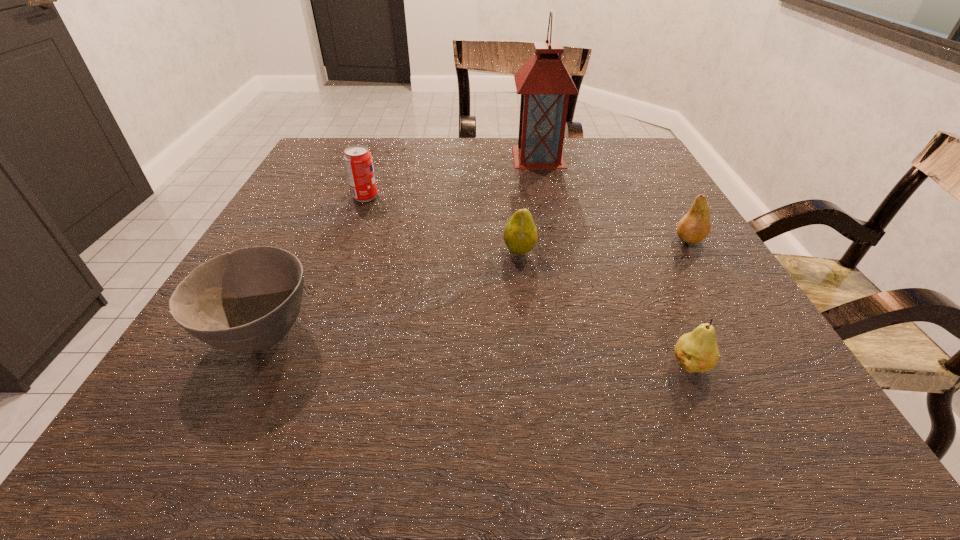
Find the location of a particular element. The image size is (960, 540). free space that is in between the lantern and the rightmost pear is located at coordinates (613, 198).

Locate an element on the screen. This screenshot has height=540, width=960. unoccupied position between the leftmost pear and the second pear from right to left is located at coordinates (605, 308).

This screenshot has height=540, width=960. What are the coordinates of `free space between the second object from right to left and the leftmost pear` in the screenshot? It's located at (605, 308).

Find the location of a particular element. free space between the second pear from left to right and the rightmost object is located at coordinates (690, 301).

Locate an element on the screen. object that is the nearest to the rightmost pear is located at coordinates 697,351.

Select which object is the fourth closest to the rightmost pear. Please provide its 2D coordinates. Your answer should be formatted as a tuple, i.e. [(x, y)], where the tuple contains the x and y coordinates of a point satisfying the conditions above.

[(358, 161)]

Locate an element on the screen. The height and width of the screenshot is (540, 960). pear that is the third closest to the lantern is located at coordinates (697, 351).

Find the location of `the third closest pear to the soda can`. the third closest pear to the soda can is located at coordinates (697, 351).

Identify the location of vacant space that satisfies the following two spatial constraints: 1. on the front side of the bowl; 2. on the right side of the nearest pear. (245, 364).

At what (x,y) coordinates should I click in order to perform the action: click on vacant region that satisfies the following two spatial constraints: 1. on the back side of the bowl; 2. on the right side of the leftmost pear. Please return your answer as a coordinate pair (x, y). Looking at the image, I should click on (301, 251).